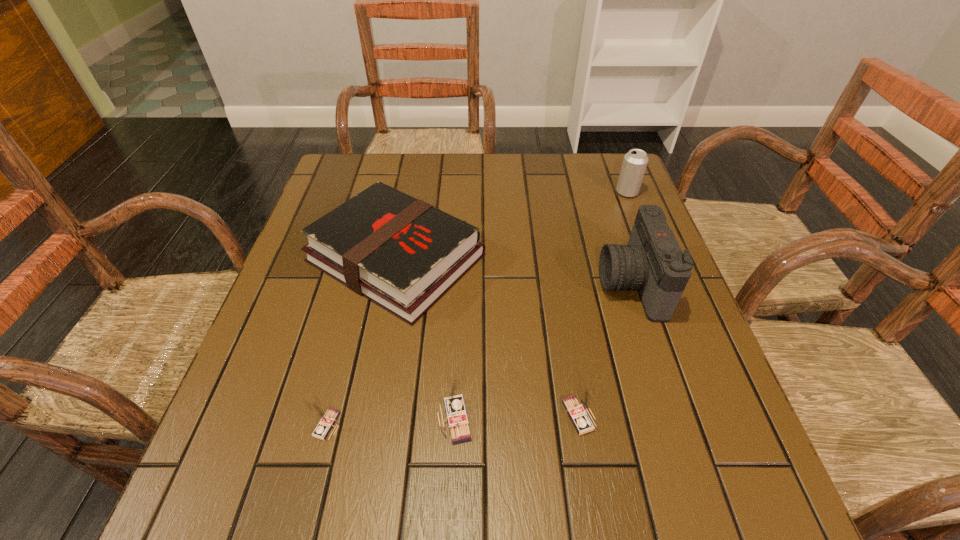
Locate an element on the screen. vacant space that satisfies the following two spatial constraints: 1. on the back side of the leftmost matchbox; 2. on the left side of the hardback book is located at coordinates (370, 258).

Locate an element on the screen. vacant point that satisfies the following two spatial constraints: 1. at the lens of the camera; 2. on the front side of the second shortest matchbox is located at coordinates (674, 416).